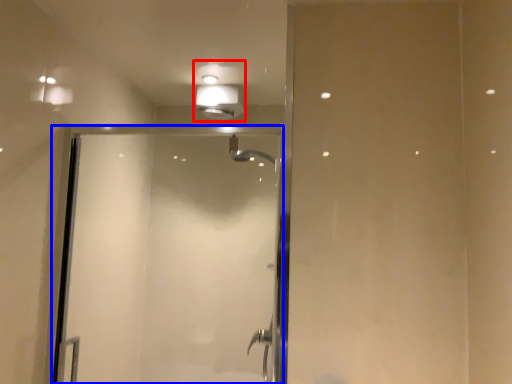
Question: Which object appears farthest to the camera in this image, light fixture (highlighted by a red box) or screen door (highlighted by a blue box)?

Choices:
 (A) light fixture
 (B) screen door

Answer: (A)